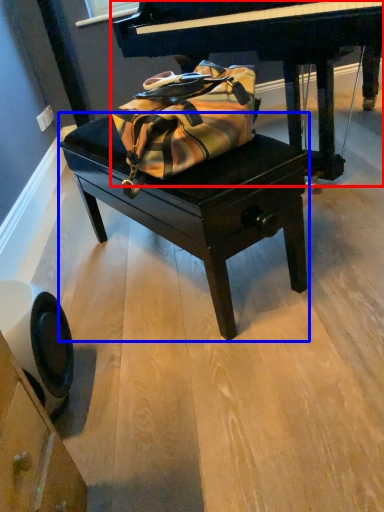
Question: Which point is closer to the camera, piano (highlighted by a red box) or table (highlighted by a blue box)?

Choices:
 (A) piano
 (B) table

Answer: (B)